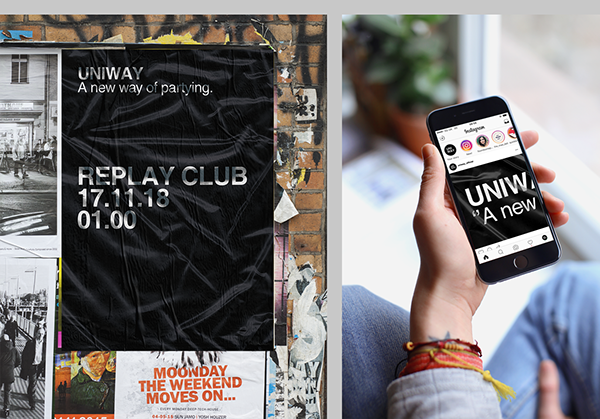
This screenshot has width=600, height=419. Identify the location of poster. (221, 112).